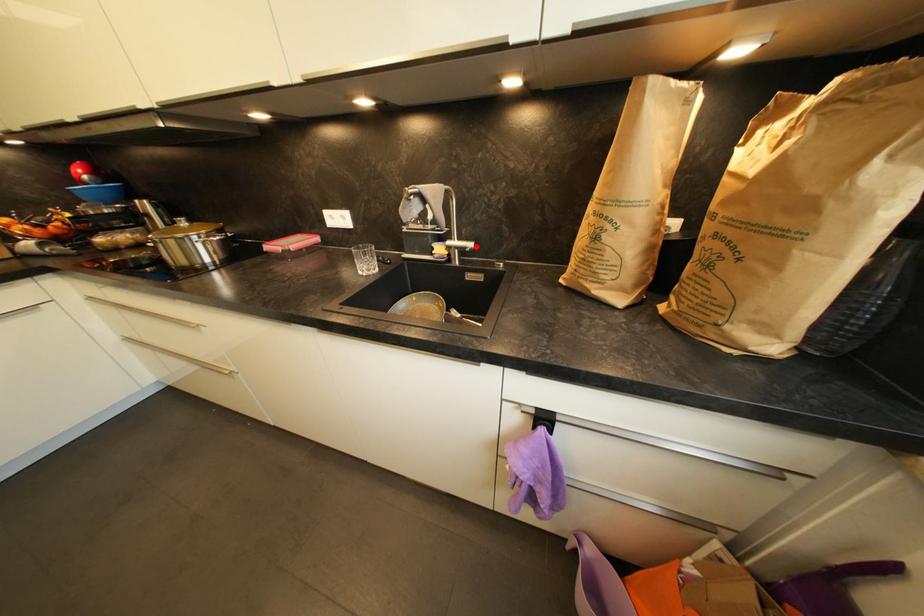
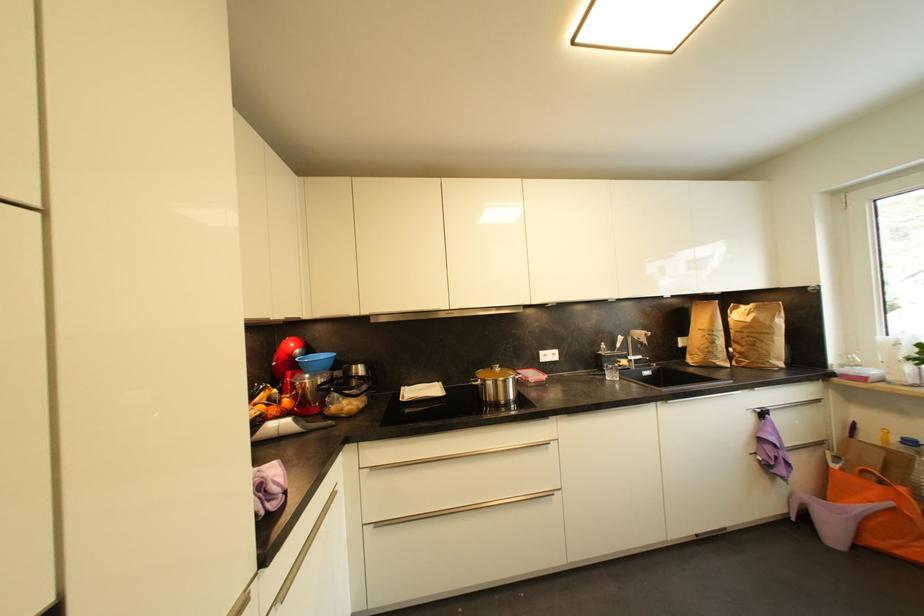
Question: I am providing you with two images of the same scene from different viewpoints. In image1, a red point is highlighted. Considering the same 3D point in image2, which of the following is correct?

Choices:
 (A) It is closer
 (B) It is farther

Answer: (B)